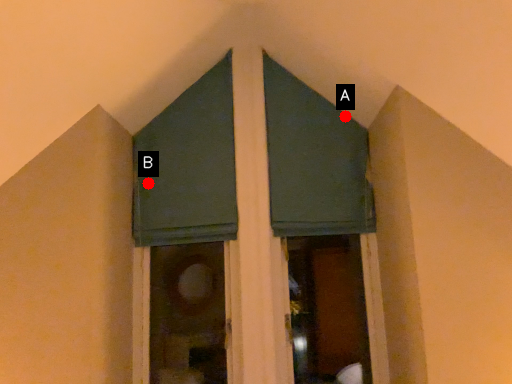
Question: Two points are circled on the image, labeled by A and B beside each circle. Which point is farther from the camera taking this photo?

Choices:
 (A) A is further
 (B) B is further

Answer: (A)